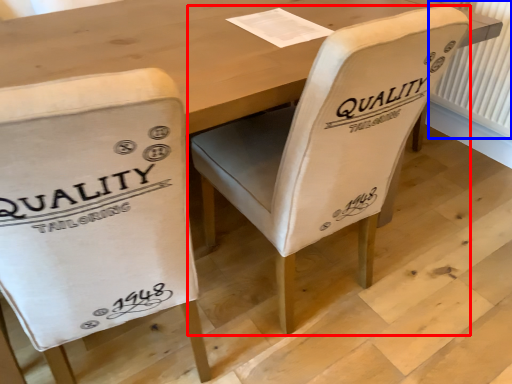
Question: Which point is closer to the camera, chair (highlighted by a red box) or radiator (highlighted by a blue box)?

Choices:
 (A) chair
 (B) radiator

Answer: (A)